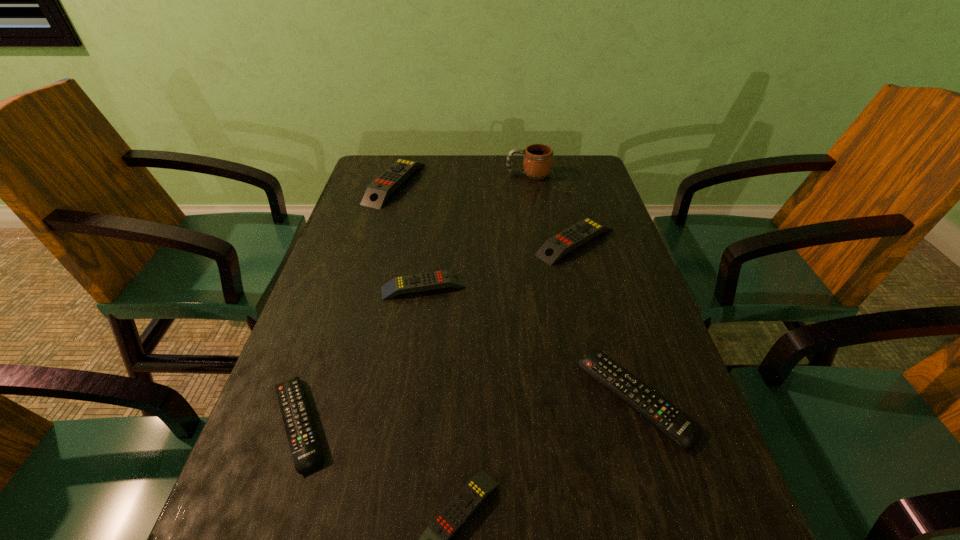
You are a GUI agent. You are given a task and a screenshot of the screen. Output one action in this format:
    pyautogui.click(x=<x>, y=<y>)
    Task: Click on the free point located on the side of the tallest object with the handle
    
    Given the screenshot: What is the action you would take?
    [455, 174]

Image resolution: width=960 pixels, height=540 pixels. What are the coordinates of `vacant region located 0.200m on the side of the tallest object with the handle` in the screenshot? It's located at (443, 174).

Locate an element on the screen. This screenshot has height=540, width=960. vacant position located on the right of the sixth shortest object is located at coordinates (454, 183).

Where is `free space located 0.200m on the back of the fifth shortest object`? This screenshot has width=960, height=540. free space located 0.200m on the back of the fifth shortest object is located at coordinates click(560, 183).

This screenshot has width=960, height=540. Identify the location of vacant area located 0.080m on the right of the second nearest yellow remote control. (501, 287).

Where is `vacant space located on the left of the bigger black remote control`? vacant space located on the left of the bigger black remote control is located at coordinates (525, 399).

This screenshot has width=960, height=540. Find the location of `free space located 0.070m on the right of the left black remote control`. free space located 0.070m on the right of the left black remote control is located at coordinates [x=376, y=423].

In order to click on mug that is at the far edge in this screenshot , I will do `click(537, 158)`.

At what (x,y) coordinates should I click in order to perform the action: click on remote control located in the far edge section of the desktop. Please return your answer as a coordinate pair (x, y). Looking at the image, I should click on (378, 191).

This screenshot has width=960, height=540. In order to click on mug that is at the right edge in this screenshot , I will do `click(537, 158)`.